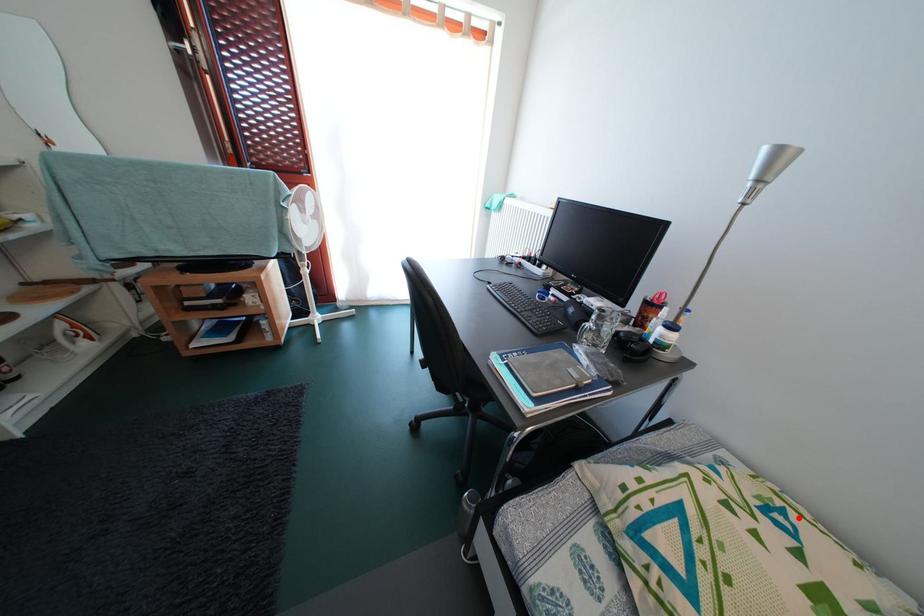
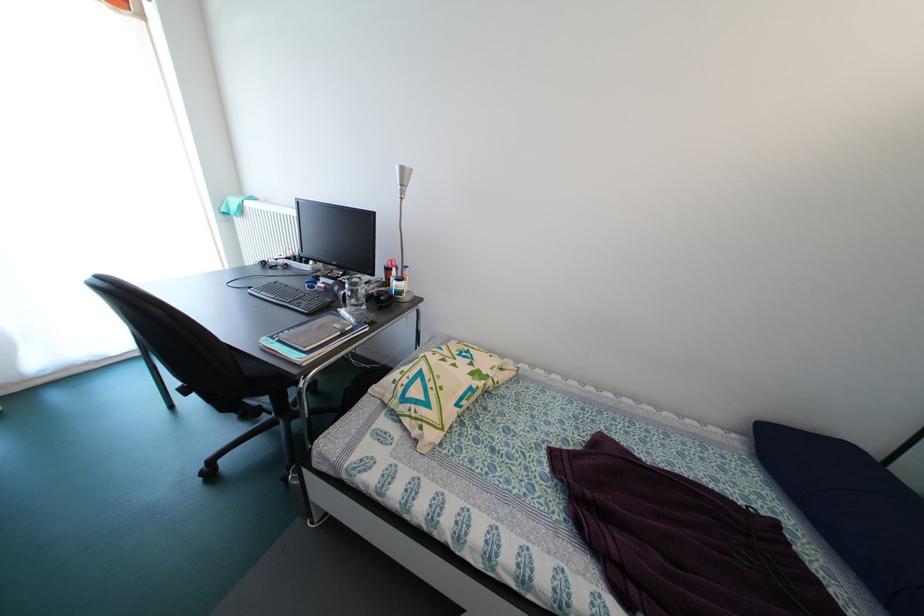
Question: I am providing you with two images of the same scene from different viewpoints. In image1, a red point is highlighted. Considering the same 3D point in image2, which of the following is correct?

Choices:
 (A) It is closer
 (B) It is farther

Answer: (B)